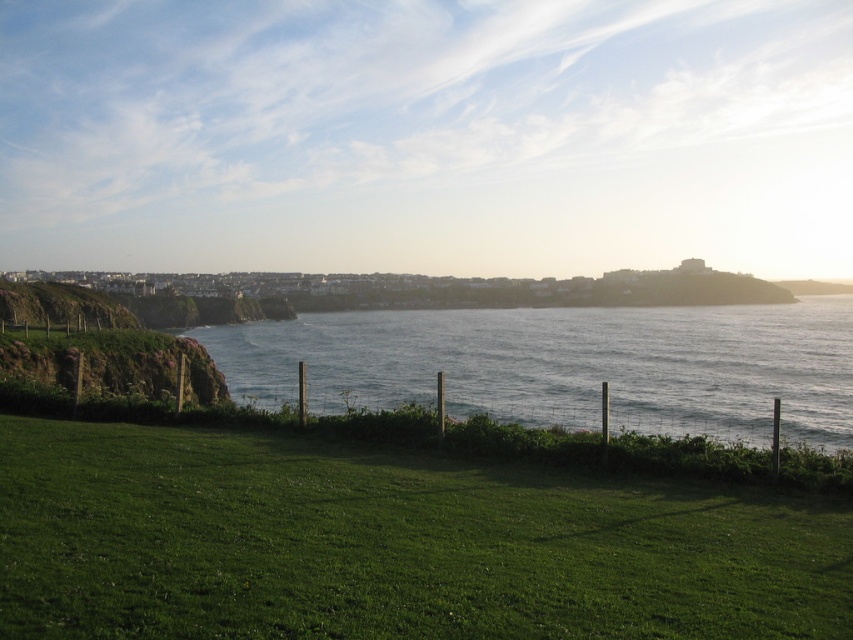
Question: Is the position of green grassy at lower center less distant than that of blue water at center?

Choices:
 (A) yes
 (B) no

Answer: (A)

Question: Is green grassy at lower center thinner than blue water at center?

Choices:
 (A) no
 (B) yes

Answer: (B)

Question: Which object appears closest to the camera in this image?

Choices:
 (A) green grassy at lower center
 (B) blue water at center

Answer: (A)

Question: Which point appears farthest from the camera in this image?

Choices:
 (A) (537, 362)
 (B) (376, 470)

Answer: (A)

Question: Can you confirm if green grassy at lower center is positioned below blue water at center?

Choices:
 (A) no
 (B) yes

Answer: (B)